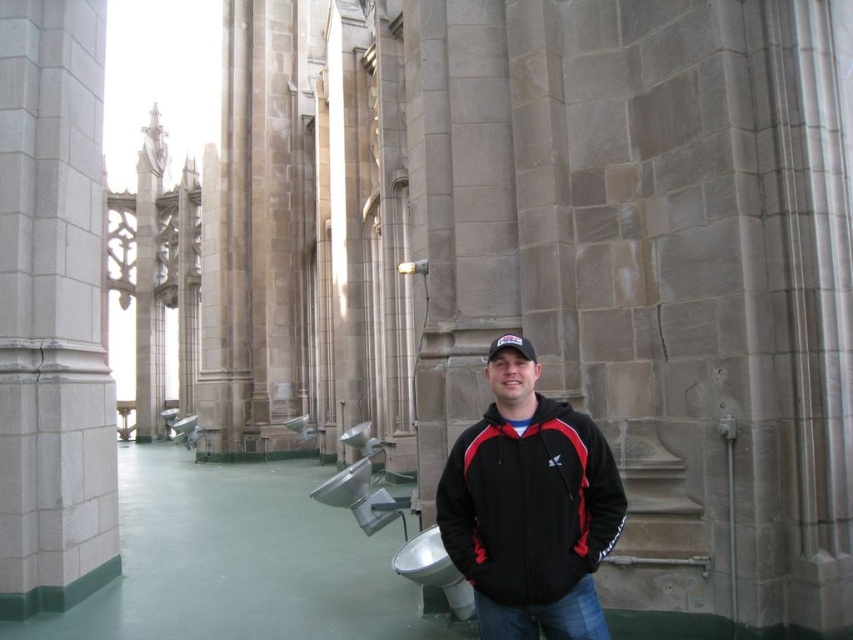
Which of these two, gray stone pillar at left or black fleece jacket at center, stands taller?

gray stone pillar at left

Which is in front, point (1, 141) or point (556, 602)?

Point (556, 602)

Is point (7, 134) positioned before point (595, 618)?

No, it is behind (595, 618).

Where is `gray stone pillar at left`? The height and width of the screenshot is (640, 853). gray stone pillar at left is located at coordinates (53, 310).